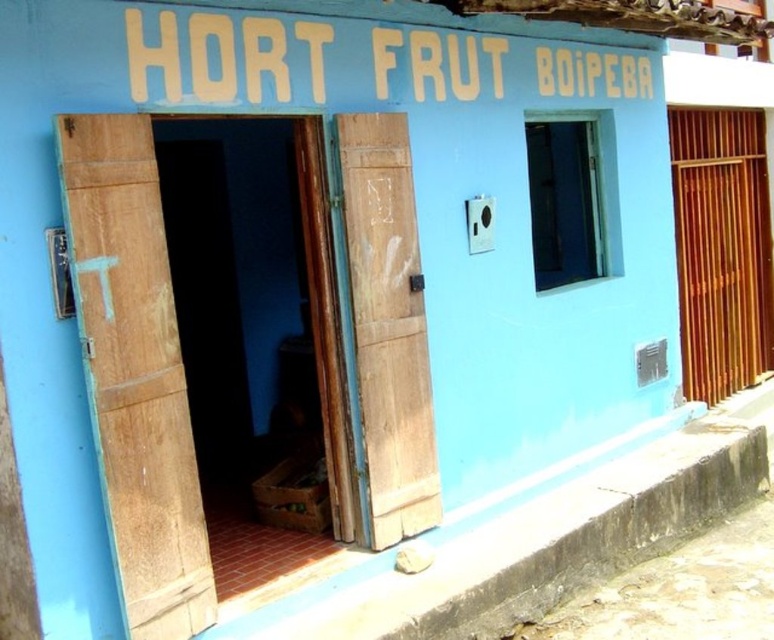
You are standing in front of the building and want to take a photo of the sign at the top. The camera you are using has a maximum focus range of 8 feet. Will the point at coordinates point [187,630] be in focus when you take the photo?

The point at coordinates point [187,630] is 8.57 feet from the camera, which exceeds the maximum focus range of 8 feet. Therefore, the point will not be in focus when taking the photo.